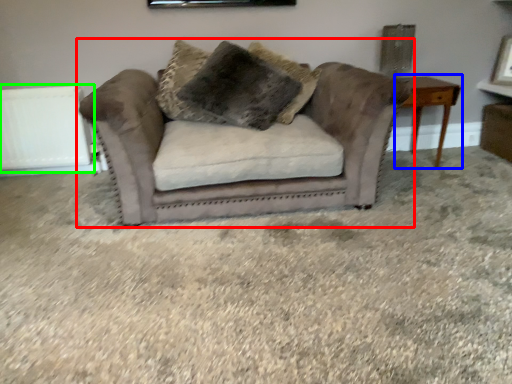
Question: Estimate the real-world distances between objects in this image. Which object is farther from studio couch (highlighted by a red box), table (highlighted by a blue box) or radiator (highlighted by a green box)?

Choices:
 (A) table
 (B) radiator

Answer: (B)